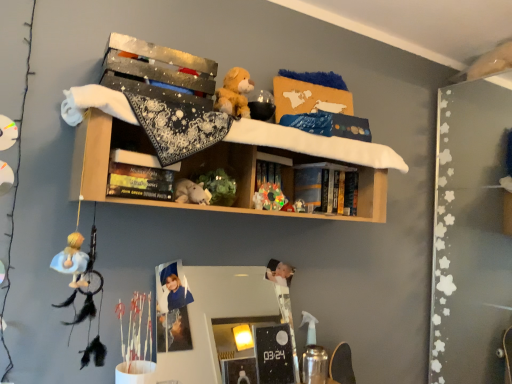
What do you see at coordinates (327, 187) in the screenshot?
I see `blue hardcover book at center, marked as the 1th book in a right-to-left arrangement` at bounding box center [327, 187].

Locate an element on the screen. The image size is (512, 384). white plush toy at center, the third toy in the right-to-left sequence is located at coordinates (x=191, y=192).

What do you see at coordinates (191, 192) in the screenshot? The height and width of the screenshot is (384, 512). I see `white plush toy at center, the 1th toy when ordered from left to right` at bounding box center [191, 192].

The height and width of the screenshot is (384, 512). Describe the element at coordinates (272, 198) in the screenshot. I see `shiny plastic toy at center, the 1th toy when ordered from right to left` at that location.

Where is `shiny plastic toy at center, the 1th toy when ordered from right to left`? The height and width of the screenshot is (384, 512). shiny plastic toy at center, the 1th toy when ordered from right to left is located at coordinates (272, 198).

This screenshot has width=512, height=384. Find the location of `blue hardcover book at center, acting as the 2th book starting from the left`. blue hardcover book at center, acting as the 2th book starting from the left is located at coordinates (327, 187).

Considering the positions of objects shiny plastic toy at center, the 1th toy when ordered from right to left, and wooden shelf at upper center in the image provided, who is more to the left, shiny plastic toy at center, the 1th toy when ordered from right to left, or wooden shelf at upper center?

Positioned to the left is wooden shelf at upper center.

Is shiny plastic toy at center, which ranks as the third toy in left-to-right order, taller than wooden shelf at upper center?

No.

Can wooden shelf at upper center be found inside shiny plastic toy at center, which ranks as the third toy in left-to-right order?

Actually, wooden shelf at upper center is outside shiny plastic toy at center, which ranks as the third toy in left-to-right order.

Find the location of `toy that is the 1st one below the wooden shelf at upper center (from a real-world perspective)`. toy that is the 1st one below the wooden shelf at upper center (from a real-world perspective) is located at coordinates (272, 198).

Is point (175, 199) closer or farther from the camera than point (341, 201)?

Point (175, 199) appears to be closer to the viewer than point (341, 201).

Between white plush toy at center, the third toy in the right-to-left sequence, and blue hardcover book at center, marked as the 1th book in a right-to-left arrangement, which one has larger size?

With larger size is blue hardcover book at center, marked as the 1th book in a right-to-left arrangement.

From a real-world perspective, is white plush toy at center, the 1th toy when ordered from left to right, on blue hardcover book at center, which is counted as the 1th book, starting from the back?

No.

From the image's perspective, which object appears higher, shiny plastic toy at center, which ranks as the third toy in left-to-right order, or hardcover book at center, which is the 2th book in right-to-left order?

hardcover book at center, which is the 2th book in right-to-left order, appears higher in the image.

From a real-world perspective, which object rests below the other?

shiny plastic toy at center, the 1th toy when ordered from right to left, from a real-world perspective.

Is the surface of shiny plastic toy at center, which ranks as the third toy in left-to-right order, in direct contact with hardcover book at center, which is the 2th book in right-to-left order?

No, shiny plastic toy at center, which ranks as the third toy in left-to-right order, is not making contact with hardcover book at center, which is the 2th book in right-to-left order.

Is shiny plastic toy at center, which ranks as the third toy in left-to-right order, oriented away from hardcover book at center, positioned as the 1th book in front-to-back order?

shiny plastic toy at center, which ranks as the third toy in left-to-right order, does not have its back to hardcover book at center, positioned as the 1th book in front-to-back order.

Is shiny plastic toy at center, which ranks as the third toy in left-to-right order, directly adjacent to white plush toy at center, the third toy in the right-to-left sequence?

No, shiny plastic toy at center, which ranks as the third toy in left-to-right order, is not touching white plush toy at center, the third toy in the right-to-left sequence.

The image size is (512, 384). I want to click on the 2nd toy to the left when counting from the shiny plastic toy at center, the 1th toy when ordered from right to left, so click(191, 192).

Between shiny plastic toy at center, the 1th toy when ordered from right to left, and white plush toy at center, the third toy in the right-to-left sequence, which one has more height?

With more height is shiny plastic toy at center, the 1th toy when ordered from right to left.

From a real-world perspective, is shiny plastic toy at center, which ranks as the third toy in left-to-right order, on white plush toy at center, the third toy in the right-to-left sequence?

Indeed, from a real-world perspective, shiny plastic toy at center, which ranks as the third toy in left-to-right order, stands above white plush toy at center, the third toy in the right-to-left sequence.

What's the angular difference between white plush toy at center, the second toy viewed from the right, and shiny plastic toy at center, the 1th toy when ordered from right to left,'s facing directions?

white plush toy at center, the second toy viewed from the right, and shiny plastic toy at center, the 1th toy when ordered from right to left, are facing 0.000737 degrees away from each other.

From a real-world perspective, starting from the shiny plastic toy at center, the 1th toy when ordered from right to left, which toy is the 2nd one below it? Please provide its 2D coordinates.

[(258, 200)]

Would you say white plush toy at center, the second toy viewed from the right, contains shiny plastic toy at center, the 1th toy when ordered from right to left?

Definitely not — shiny plastic toy at center, the 1th toy when ordered from right to left, is not inside white plush toy at center, the second toy viewed from the right.

Could you tell me if blue hardcover book at center, acting as the second book starting from the front, is facing hardcover book at center, the 1th book viewed from the left?

No, blue hardcover book at center, acting as the second book starting from the front, does not turn towards hardcover book at center, the 1th book viewed from the left.

Locate an element on the screen. book below the hardcover book at center, the 1th book viewed from the left (from the image's perspective) is located at coordinates (327, 187).

Is blue hardcover book at center, marked as the 1th book in a right-to-left arrangement, shorter than hardcover book at center, the 1th book viewed from the left?

No, blue hardcover book at center, marked as the 1th book in a right-to-left arrangement, is not shorter than hardcover book at center, the 1th book viewed from the left.

Considering the sizes of objects blue hardcover book at center, marked as the 1th book in a right-to-left arrangement, and hardcover book at center, the 2th book when ordered from back to front, in the image provided, who is wider, blue hardcover book at center, marked as the 1th book in a right-to-left arrangement, or hardcover book at center, the 2th book when ordered from back to front,?

Wider between the two is hardcover book at center, the 2th book when ordered from back to front.

From a real-world perspective, relative to blue hardcover book at center, acting as the 2th book starting from the left, is white plush toy at center, the second toy viewed from the right, vertically above or below?

From a real-world perspective, white plush toy at center, the second toy viewed from the right, is physically below blue hardcover book at center, acting as the 2th book starting from the left.

Who is more distant, white plush toy at center, the second toy viewed from the right, or blue hardcover book at center, acting as the 2th book starting from the left?

blue hardcover book at center, acting as the 2th book starting from the left.

Is point (260, 198) behind point (313, 194)?

That is False.

Is white plush toy at center, the second toy viewed from the right, positioned with its back to blue hardcover book at center, acting as the second book starting from the front?

No, white plush toy at center, the second toy viewed from the right, is not facing away from blue hardcover book at center, acting as the second book starting from the front.

Identify the location of the 2nd toy positioned below the wooden shelf at upper center (from the image's perspective). (272, 198).

Which toy is the 3rd one when counting from the front of the blue hardcover book at center, marked as the 1th book in a right-to-left arrangement? Please provide its 2D coordinates.

[(191, 192)]

When comparing their distances from wooden shelf at upper center, does shiny plastic toy at center, the 1th toy when ordered from right to left, or white plush toy at center, which appears as the 2th toy when viewed from the left, seem closer?

Among the two, shiny plastic toy at center, the 1th toy when ordered from right to left, is located nearer to wooden shelf at upper center.

Consider the image. Estimate the real-world distances between objects in this image. Which object is further from hardcover book at center, the 1th book viewed from the left, white plush toy at center, the second toy viewed from the right, or wooden shelf at upper center?

white plush toy at center, the second toy viewed from the right, is positioned further to the anchor hardcover book at center, the 1th book viewed from the left.

Which object lies further to the anchor point white plush toy at center, which appears as the 2th toy when viewed from the left, wooden shelf at upper center or blue hardcover book at center, acting as the 2th book starting from the left?

wooden shelf at upper center is further to white plush toy at center, which appears as the 2th toy when viewed from the left.

Looking at the image, which one is located closer to wooden shelf at upper center, hardcover book at center, positioned as the 1th book in front-to-back order, or white plush toy at center, which appears as the 2th toy when viewed from the left?

hardcover book at center, positioned as the 1th book in front-to-back order, is closer to wooden shelf at upper center.

When comparing their distances from white plush toy at center, the second toy viewed from the right, does wooden shelf at upper center or hardcover book at center, the 2th book when ordered from back to front, seem closer?

hardcover book at center, the 2th book when ordered from back to front, is positioned closer to the anchor white plush toy at center, the second toy viewed from the right.

Estimate the real-world distances between objects in this image. Which object is closer to blue hardcover book at center, acting as the 2th book starting from the left, shiny plastic toy at center, which ranks as the third toy in left-to-right order, or hardcover book at center, which is the 2th book in right-to-left order?

Based on the image, shiny plastic toy at center, which ranks as the third toy in left-to-right order, appears to be nearer to blue hardcover book at center, acting as the 2th book starting from the left.

Based on their spatial positions, is shiny plastic toy at center, the 1th toy when ordered from right to left, or blue hardcover book at center, acting as the second book starting from the front, closer to wooden shelf at upper center?

The object closer to wooden shelf at upper center is blue hardcover book at center, acting as the second book starting from the front.

From the picture: Looking at the image, which one is located closer to blue hardcover book at center, marked as the 1th book in a right-to-left arrangement, wooden shelf at upper center or white plush toy at center, the third toy in the right-to-left sequence?

The object closer to blue hardcover book at center, marked as the 1th book in a right-to-left arrangement, is wooden shelf at upper center.

The height and width of the screenshot is (384, 512). In order to click on shelf between hardcover book at center, which is the 2th book in right-to-left order, and white plush toy at center, which appears as the 2th toy when viewed from the left in this screenshot , I will do `click(115, 116)`.

The image size is (512, 384). In order to click on toy between wooden shelf at upper center and white plush toy at center, the second toy viewed from the right, in the front-back direction in this screenshot , I will do `click(191, 192)`.

Locate an element on the screen. toy located between hardcover book at center, positioned as the 1th book in front-to-back order, and white plush toy at center, which appears as the 2th toy when viewed from the left, in the left-right direction is located at coordinates (191, 192).

This screenshot has height=384, width=512. I want to click on book between wooden shelf at upper center and blue hardcover book at center, acting as the 2th book starting from the left, from front to back, so click(140, 182).